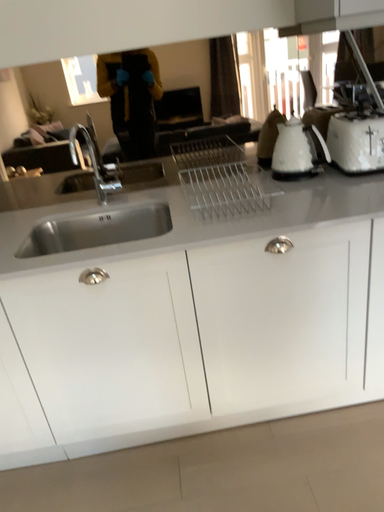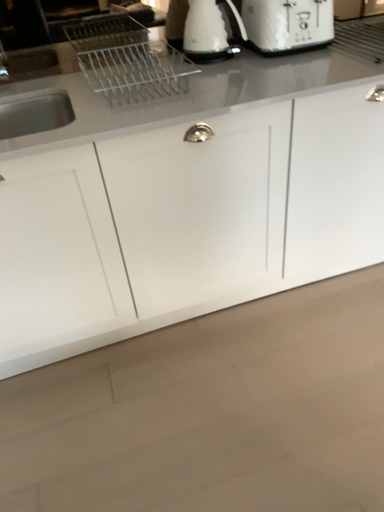
Question: How did the camera likely rotate when shooting the video?

Choices:
 (A) rotated downward
 (B) rotated upward

Answer: (A)